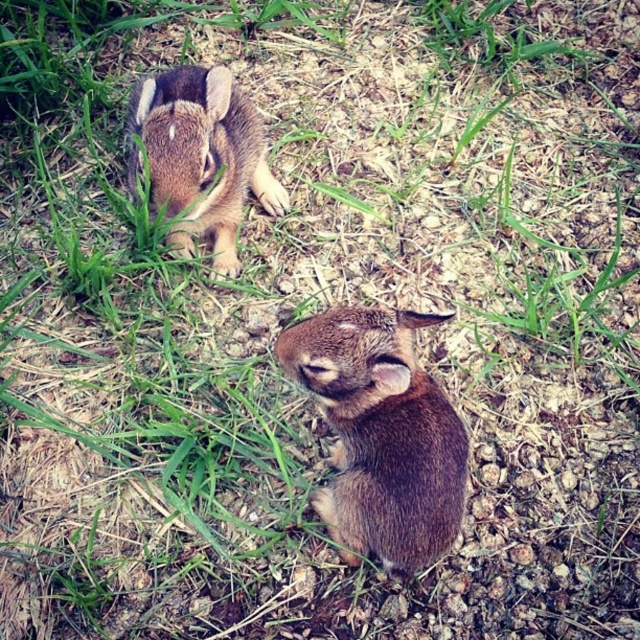
Does brown furry rabbit at center lie in front of brown furry rabbit at upper left?

Yes, it is.

This screenshot has height=640, width=640. Identify the location of brown furry rabbit at center. (381, 435).